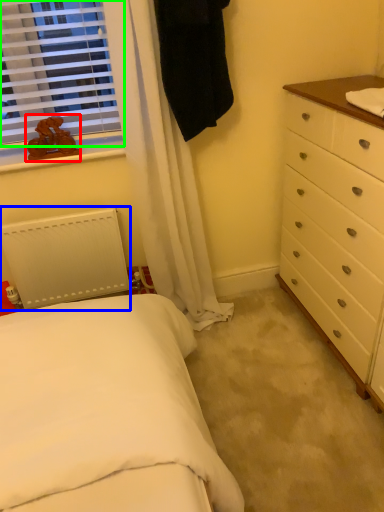
Question: Based on their relative distances, which object is farther from toy (highlighted by a red box)? Choose from radiator (highlighted by a blue box) and window (highlighted by a green box).

Choices:
 (A) radiator
 (B) window

Answer: (A)